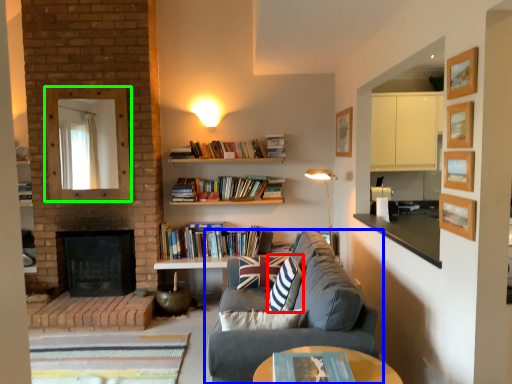
Question: Which is farther away from throw pillow (highlighted by a red box)? studio couch (highlighted by a blue box) or mirror (highlighted by a green box)?

Choices:
 (A) studio couch
 (B) mirror

Answer: (B)